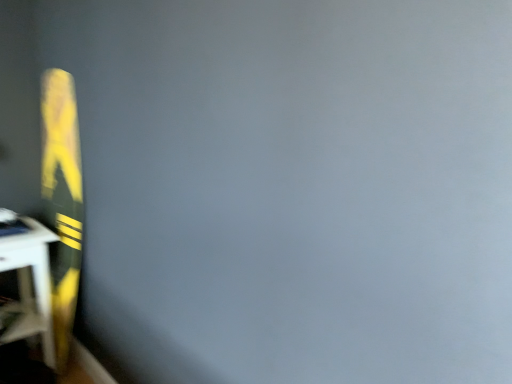
The height and width of the screenshot is (384, 512). Describe the element at coordinates (29, 287) in the screenshot. I see `matte black table at left` at that location.

This screenshot has width=512, height=384. I want to click on matte black table at left, so click(29, 287).

What do you see at coordinates (62, 201) in the screenshot?
I see `green matte board at left` at bounding box center [62, 201].

Find the location of a particular element. The width and height of the screenshot is (512, 384). green matte board at left is located at coordinates (62, 201).

The width and height of the screenshot is (512, 384). Identify the location of matte black table at left. pyautogui.click(x=29, y=287).

Considering the relative positions of green matte board at left and matte black table at left in the image provided, is green matte board at left to the right of matte black table at left from the viewer's perspective?

Yes, green matte board at left is to the right of matte black table at left.

Which object is further away from the camera taking this photo, green matte board at left or matte black table at left?

matte black table at left is further away from the camera.

Is point (63, 351) closer to viewer compared to point (1, 315)?

No, (63, 351) is behind (1, 315).

From the image's perspective, does green matte board at left appear higher than matte black table at left?

Yes.

From a real-world perspective, is green matte board at left below matte black table at left?

No, from a real-world perspective, green matte board at left is not under matte black table at left.

Considering the relative sizes of green matte board at left and matte black table at left in the image provided, is green matte board at left wider than matte black table at left?

In fact, green matte board at left might be narrower than matte black table at left.

Between green matte board at left and matte black table at left, which one has more height?

With more height is green matte board at left.

Can you confirm if green matte board at left is bigger than matte black table at left?

Correct, green matte board at left is larger in size than matte black table at left.

Consider the image. Which is correct: green matte board at left is inside matte black table at left, or outside of it?

green matte board at left is spatially situated outside matte black table at left.

Are green matte board at left and matte black table at left located far from each other?

green matte board at left is near matte black table at left, not far away.

In the scene shown: Is green matte board at left looking in the opposite direction of matte black table at left?

Yes.

Looking at this image, how many degrees apart are the facing directions of green matte board at left and matte black table at left?

91.1 degrees separate the facing orientations of green matte board at left and matte black table at left.

Where is `furniture that appears behind the green matte board at left`? furniture that appears behind the green matte board at left is located at coordinates (29, 287).

Which object is positioned more to the left, matte black table at left or green matte board at left?

From the viewer's perspective, matte black table at left appears more on the left side.

Is the position of matte black table at left more distant than that of green matte board at left?

Yes, it is behind green matte board at left.

Is point (18, 220) closer to viewer compared to point (68, 348)?

No, it is behind (68, 348).

From the image's perspective, is matte black table at left located above or below green matte board at left?

From the image's perspective, matte black table at left appears below green matte board at left.

From a real-world perspective, is matte black table at left located higher than green matte board at left?

Actually, matte black table at left is physically below green matte board at left in the real world.

Considering the sizes of objects matte black table at left and green matte board at left in the image provided, who is wider, matte black table at left or green matte board at left?

matte black table at left is wider.

Is matte black table at left taller or shorter than green matte board at left?

Considering their sizes, matte black table at left has less height than green matte board at left.

Considering the sizes of objects matte black table at left and green matte board at left in the image provided, who is bigger, matte black table at left or green matte board at left?

With larger size is green matte board at left.

Would you say matte black table at left is inside or outside green matte board at left?

matte black table at left is not enclosed by green matte board at left.

Is matte black table at left with green matte board at left?

matte black table at left and green matte board at left are clearly separated.

Does matte black table at left turn towards green matte board at left?

No, matte black table at left is not facing towards green matte board at left.

The width and height of the screenshot is (512, 384). What are the coordinates of `furniture behind the green matte board at left` in the screenshot? It's located at (29, 287).

The image size is (512, 384). I want to click on bulletin board on the right of matte black table at left, so tap(62, 201).

Identify the location of furniture below the green matte board at left (from a real-world perspective). (29, 287).